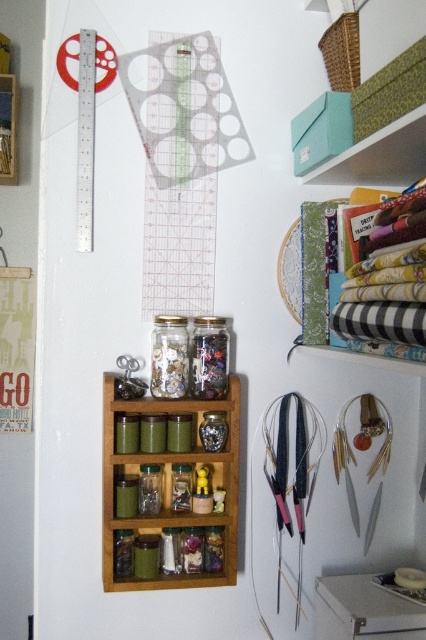
You are organizing your craft supplies and need to know the spatial relationship between the transparent plastic ruler at upper left and the transparent glass jar at center. Which one is positioned higher up in the image?

The transparent plastic ruler at upper left is located above the transparent glass jar at center, so it is positioned higher up in the image.

You have a small craft item that needs to be placed either on the transparent plastic ruler at upper left or the transparent glass jar at center. Which object can the item fit on if it requires a larger surface area?

The transparent glass jar at center has a larger surface area than the transparent plastic ruler at upper left, so the item can fit on the transparent glass jar at center.

Looking at this image, what is the location of the point with coordinates (169, 484) in the craft workspace?

The point with coordinates (169, 484) is located on the wooden spice rack at center.